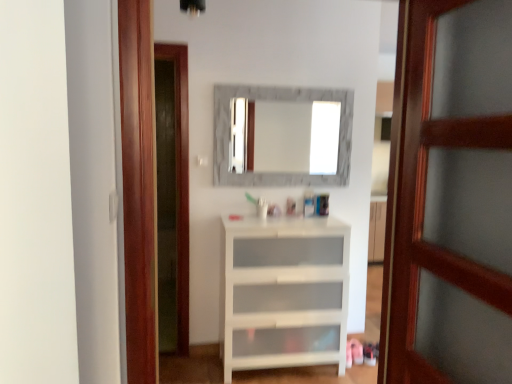
Question: From the image's perspective, relative to marble frame mirror at center, is white glossy cabinet at center above or below?

Choices:
 (A) above
 (B) below

Answer: (B)

Question: Based on their positions, is white glossy cabinet at center located to the left or right of marble frame mirror at center?

Choices:
 (A) left
 (B) right

Answer: (A)

Question: Which object is positioned closest to the wooden door at right?

Choices:
 (A) white glossy cabinet at center
 (B) marble frame mirror at center
 (C) white glossy cabinet at center

Answer: (C)

Question: Which object is positioned closest to the marble frame mirror at center?

Choices:
 (A) white glossy cabinet at center
 (B) white glossy cabinet at center
 (C) wooden door at right

Answer: (B)